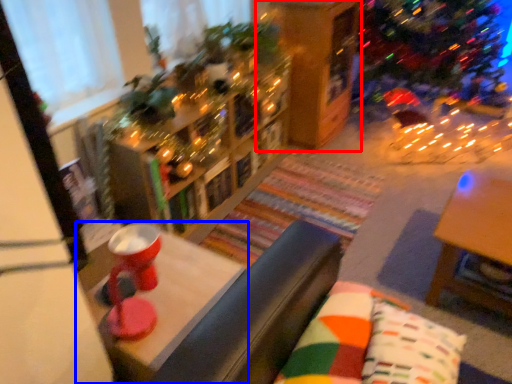
Question: Which of the following is the closest to the observer, shelf (highlighted by a red box) or table (highlighted by a blue box)?

Choices:
 (A) shelf
 (B) table

Answer: (B)